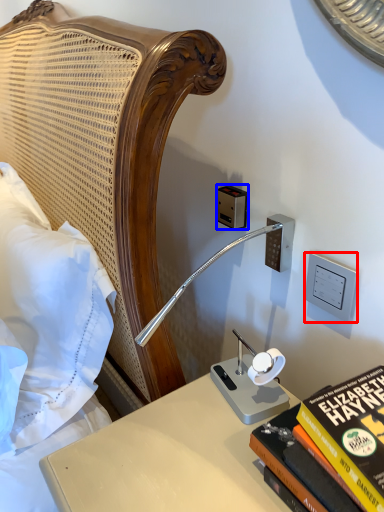
Question: Among these objects, which one is nearest to the camera, electric outlet (highlighted by a red box) or electric outlet (highlighted by a blue box)?

Choices:
 (A) electric outlet
 (B) electric outlet

Answer: (A)